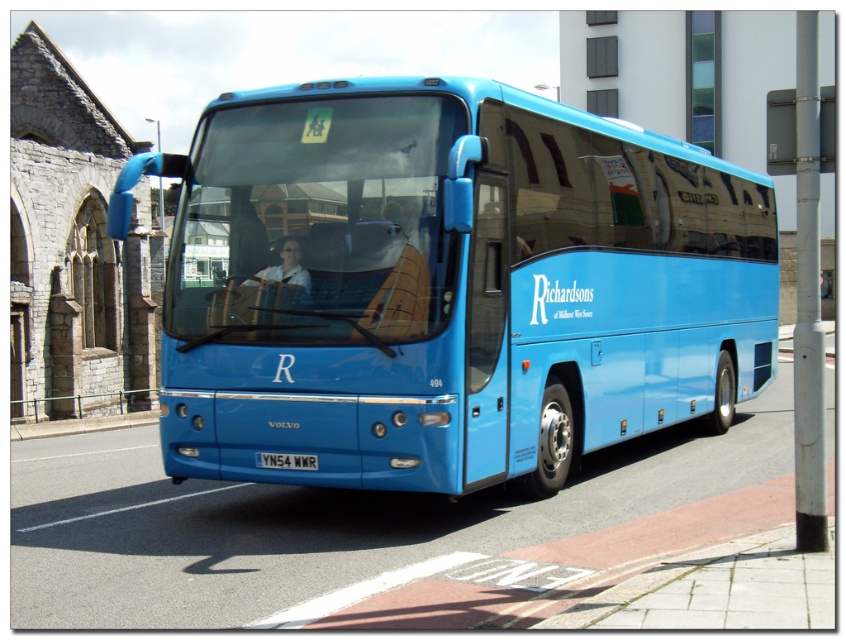
You are a pedestrian standing on the sidewalk next to the blue metallic bus at center. You want to look at the white plastic license plate at center. Do you need to walk forward or backward to see it better?

The blue metallic bus at center is closer to the viewer than the white plastic license plate at center, so you need to walk forward to see it better.